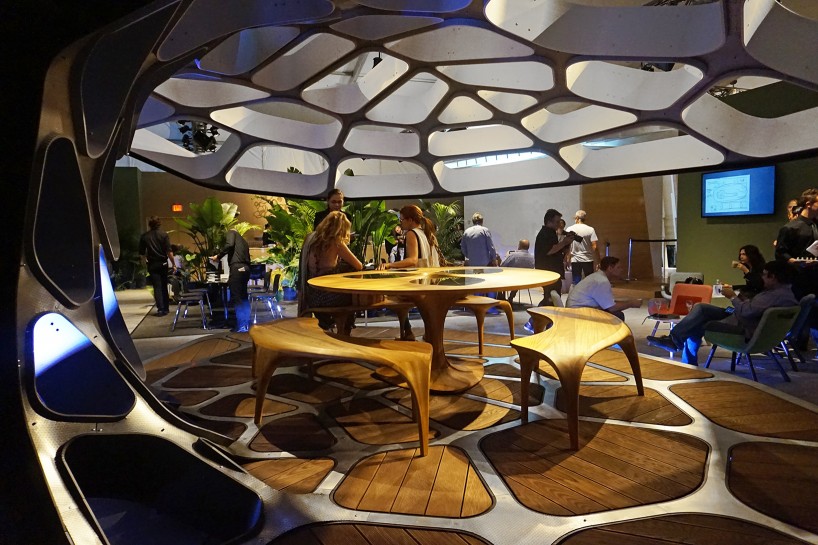
Where is `orange chair`? This screenshot has height=545, width=818. orange chair is located at coordinates (685, 289), (685, 302).